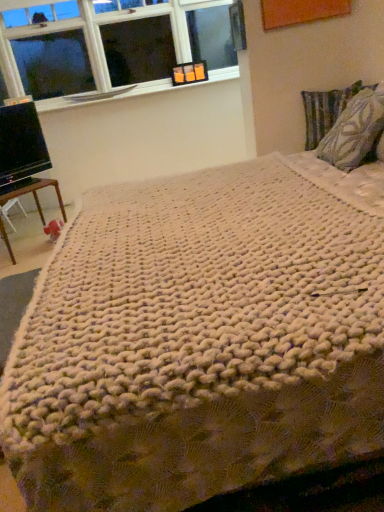
Question: Considering the relative positions of clear glass window at upper left and patterned fabric pillow at right, which is the 2th pillow from back to front, in the image provided, is clear glass window at upper left to the left or to the right of patterned fabric pillow at right, which is the 2th pillow from back to front,?

Choices:
 (A) right
 (B) left

Answer: (B)

Question: Is clear glass window at upper left inside or outside of patterned fabric pillow at right, which is the 2th pillow from back to front?

Choices:
 (A) inside
 (B) outside

Answer: (B)

Question: Which of these objects is positioned closest to the textured fabric pillow at upper right, placed as the 2th pillow when sorted from front to back?

Choices:
 (A) black glossy monitor at left
 (B) brown wooden table at lower left
 (C) orange plastic picture frame at upper center
 (D) white textured window sill at upper left
 (E) patterned fabric pillow at right, the first pillow when ordered from front to back

Answer: (E)

Question: Which object is positioned farthest from the patterned fabric pillow at right, the first pillow when ordered from front to back?

Choices:
 (A) orange plastic picture frame at upper center
 (B) white textured window sill at upper left
 (C) textured fabric pillow at upper right, arranged as the 1th pillow when viewed from the back
 (D) black glossy monitor at left
 (E) brown wooden table at lower left

Answer: (B)